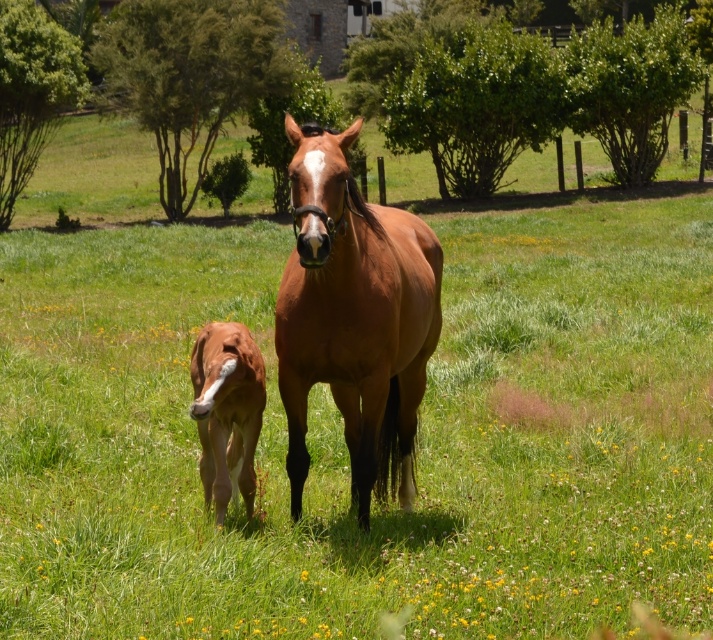
Question: Does brown glossy horse at center have a smaller size compared to brown glossy pony at center?

Choices:
 (A) yes
 (B) no

Answer: (B)

Question: Is brown glossy horse at center below brown glossy pony at center?

Choices:
 (A) yes
 (B) no

Answer: (B)

Question: Is brown glossy horse at center thinner than brown glossy pony at center?

Choices:
 (A) no
 (B) yes

Answer: (A)